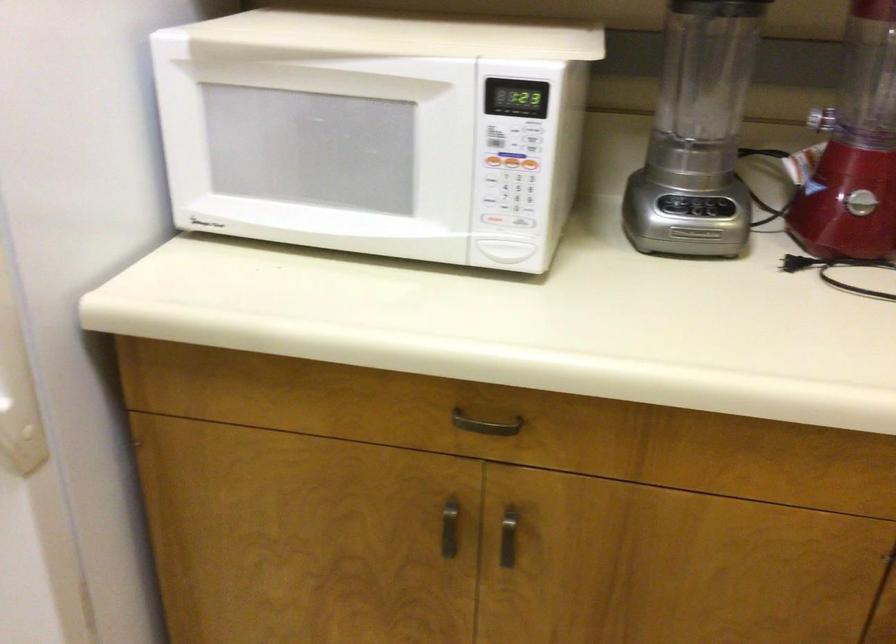
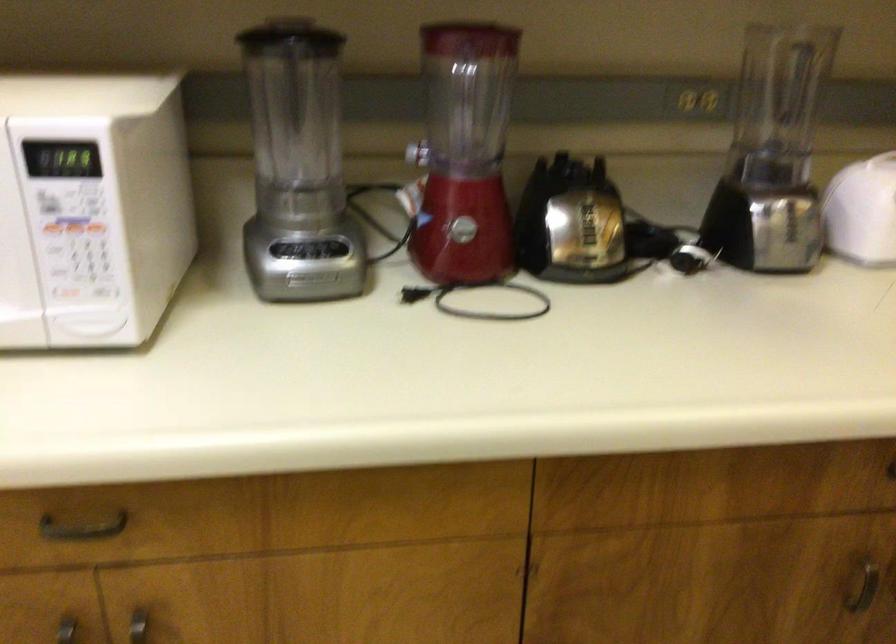
Where in the second image is the point corresponding to pixel 695 232 from the first image?

(309, 278)